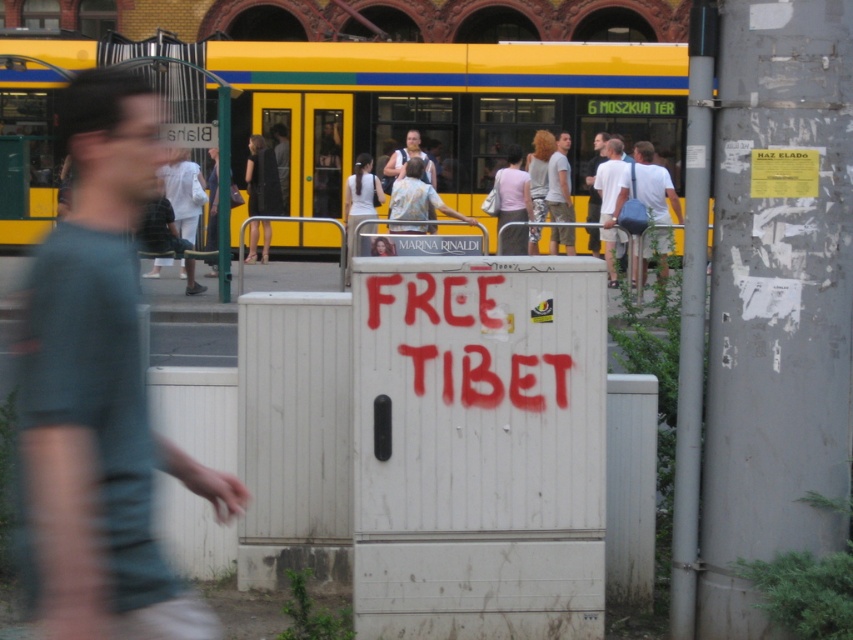
You are a photographer standing in the street scene. You notice the yellow painted metal train at upper center and the white cotton shirt at center. Which object appears smaller in the image?

The yellow painted metal train at upper center appears smaller than the white cotton shirt at center.

Based on the photo, you are a pedestrian standing on the sidewalk and see the yellow painted metal train at upper center and the white cotton shirt at upper center. Which object is closer to the left side of your view?

The yellow painted metal train at upper center is closer to the left side of your view because it is positioned to the left of the white cotton shirt at upper center.

You are a photographer standing in front of the tram and want to take a photo of the white cotton shirt at center and the light pink fabric shirt at center. Which shirt should you focus on first to ensure both are in focus?

You should focus on the white cotton shirt at center first because it is closer to the viewer than the light pink fabric shirt at center. By focusing on the closer shirt, the depth of field may also capture the light pink fabric shirt at center in focus.